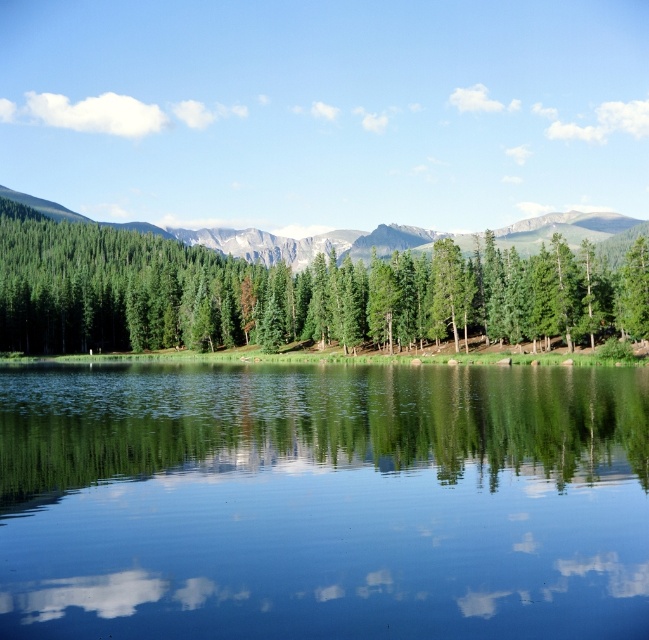
Question: Is green matte tree at center positioned in front of green forested mountain at center?

Choices:
 (A) yes
 (B) no

Answer: (A)

Question: Can you confirm if green matte tree at center is positioned to the left of green forested mountain at center?

Choices:
 (A) yes
 (B) no

Answer: (A)

Question: Which object is positioned closest to the green glossy water at center?

Choices:
 (A) green forested mountain at center
 (B) green matte tree at center

Answer: (B)

Question: Which of the following is the closest to the observer?

Choices:
 (A) green glossy water at center
 (B) green forested mountain at center

Answer: (A)

Question: Which point is farther to the camera?

Choices:
 (A) green glossy water at center
 (B) green forested mountain at center
 (C) green matte tree at center

Answer: (B)

Question: Is green glossy water at center further to camera compared to green matte tree at center?

Choices:
 (A) yes
 (B) no

Answer: (B)